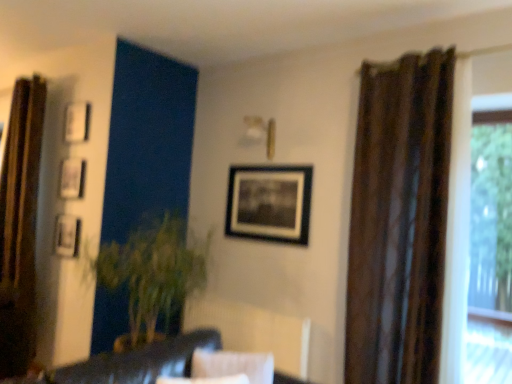
Question: Is metallic silver picture frame at upper left, marked as the 1th picture frame in a left-to-right arrangement, far away from matte black picture frame at upper left, arranged as the 3th picture frame when viewed from the right?

Choices:
 (A) no
 (B) yes

Answer: (A)

Question: Is matte black picture frame at upper left, arranged as the 3th picture frame when viewed from the right, at the back of metallic silver picture frame at upper left, marked as the 1th picture frame in a left-to-right arrangement?

Choices:
 (A) yes
 (B) no

Answer: (B)

Question: From the image's perspective, would you say metallic silver picture frame at upper left, marked as the 1th picture frame in a left-to-right arrangement, is positioned over matte black picture frame at upper left, which appears as the second picture frame when viewed from the left?

Choices:
 (A) no
 (B) yes

Answer: (A)

Question: Is metallic silver picture frame at upper left, marked as the 1th picture frame in a left-to-right arrangement, located outside matte black picture frame at upper left, arranged as the 3th picture frame when viewed from the right?

Choices:
 (A) yes
 (B) no

Answer: (A)

Question: Considering the relative sizes of metallic silver picture frame at upper left, marked as the 1th picture frame in a left-to-right arrangement, and matte black picture frame at upper left, which appears as the second picture frame when viewed from the left, in the image provided, is metallic silver picture frame at upper left, marked as the 1th picture frame in a left-to-right arrangement, shorter than matte black picture frame at upper left, which appears as the second picture frame when viewed from the left,?

Choices:
 (A) yes
 (B) no

Answer: (B)

Question: Would you say white matte picture frame at upper left, placed as the third picture frame when sorted from left to right, is to the left or to the right of metallic silver picture frame at upper left, marked as the 1th picture frame in a left-to-right arrangement, in the picture?

Choices:
 (A) left
 (B) right

Answer: (B)

Question: In terms of height, does white matte picture frame at upper left, placed as the third picture frame when sorted from left to right, look taller or shorter compared to metallic silver picture frame at upper left, marked as the 1th picture frame in a left-to-right arrangement?

Choices:
 (A) tall
 (B) short

Answer: (B)

Question: From the image's perspective, is white matte picture frame at upper left, placed as the third picture frame when sorted from left to right, above or below metallic silver picture frame at upper left, which is counted as the fourth picture frame, starting from the right?

Choices:
 (A) below
 (B) above

Answer: (B)

Question: Considering the positions of white matte picture frame at upper left, the second picture frame when ordered from right to left, and metallic silver picture frame at upper left, which is counted as the fourth picture frame, starting from the right, in the image, is white matte picture frame at upper left, the second picture frame when ordered from right to left, bigger or smaller than metallic silver picture frame at upper left, which is counted as the fourth picture frame, starting from the right,?

Choices:
 (A) small
 (B) big

Answer: (B)

Question: Visually, is dark brown leather couch at lower center positioned to the left or to the right of brown textured curtain at right, placed as the 2th curtain when sorted from left to right?

Choices:
 (A) left
 (B) right

Answer: (A)

Question: Considering the positions of dark brown leather couch at lower center and brown textured curtain at right, placed as the 2th curtain when sorted from left to right, in the image, is dark brown leather couch at lower center taller or shorter than brown textured curtain at right, placed as the 2th curtain when sorted from left to right,?

Choices:
 (A) short
 (B) tall

Answer: (A)

Question: Relative to brown textured curtain at right, the first curtain from the front, is dark brown leather couch at lower center in front or behind?

Choices:
 (A) front
 (B) behind

Answer: (A)

Question: Is dark brown leather couch at lower center inside or outside of brown textured curtain at right, positioned as the second curtain in back-to-front order?

Choices:
 (A) inside
 (B) outside

Answer: (B)

Question: Is black matte picture frame at center, arranged as the 1th picture frame when viewed from the right, inside the boundaries of dark brown leather couch at lower center, or outside?

Choices:
 (A) inside
 (B) outside

Answer: (B)

Question: Considering the positions of black matte picture frame at center, placed as the 4th picture frame when sorted from left to right, and dark brown leather couch at lower center in the image, is black matte picture frame at center, placed as the 4th picture frame when sorted from left to right, wider or thinner than dark brown leather couch at lower center?

Choices:
 (A) thin
 (B) wide

Answer: (A)